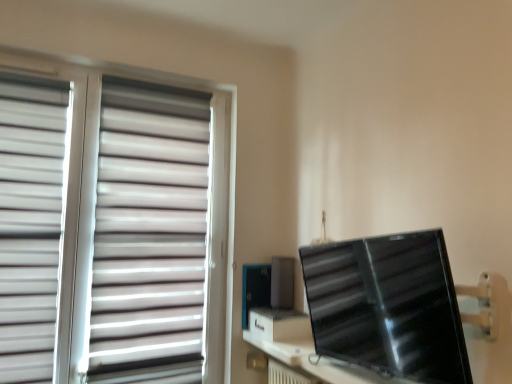
What is the approximate width of white matte blinds at left, the second curtain viewed from the right?

It is 3.54 inches.

Where is `white matte blinds at left, which is the 2th curtain in left-to-right order`? white matte blinds at left, which is the 2th curtain in left-to-right order is located at coordinates (150, 234).

Between white matte blinds at left, marked as the 1th curtain in a right-to-left arrangement, and white matte blinds at left, the first curtain viewed from the left, which one has more height?

white matte blinds at left, marked as the 1th curtain in a right-to-left arrangement.

Is white matte blinds at left, which is the 2th curtain in left-to-right order, next to white matte blinds at left, the second curtain viewed from the right?

No, white matte blinds at left, which is the 2th curtain in left-to-right order, is not beside white matte blinds at left, the second curtain viewed from the right.

Locate an element on the screen. computer monitor lying on the right of white matte blinds at left, which is the 2th curtain in left-to-right order is located at coordinates (388, 306).

From the image's perspective, which one is positioned higher, white matte blinds at left, which is the 2th curtain in left-to-right order, or black glossy monitor at right?

white matte blinds at left, which is the 2th curtain in left-to-right order, from the image's perspective.

From a real-world perspective, which is physically above, white matte blinds at left, which is the 2th curtain in left-to-right order, or black glossy monitor at right?

Answer: white matte blinds at left, which is the 2th curtain in left-to-right order, is physically above.

Is the position of black glossy monitor at right more distant than that of white matte blinds at left, the second curtain viewed from the right?

No, it is in front of white matte blinds at left, the second curtain viewed from the right.

Is black glossy monitor at right oriented towards white matte blinds at left, the second curtain viewed from the right?

No.

Would you say white matte blinds at left, the second curtain viewed from the right, is part of black glossy monitor at right's contents?

No, black glossy monitor at right does not contain white matte blinds at left, the second curtain viewed from the right.

From a real-world perspective, who is located higher, white matte blinds at left, marked as the 1th curtain in a right-to-left arrangement, or white matte blinds at left?

white matte blinds at left, marked as the 1th curtain in a right-to-left arrangement.

Is white matte blinds at left, marked as the 1th curtain in a right-to-left arrangement, positioned with its back to white matte blinds at left?

Yes, white matte blinds at left, marked as the 1th curtain in a right-to-left arrangement, is positioned with its back facing white matte blinds at left.

Is white matte blinds at left, marked as the 1th curtain in a right-to-left arrangement, wider or thinner than white matte blinds at left?

Considering their sizes, white matte blinds at left, marked as the 1th curtain in a right-to-left arrangement, looks broader than white matte blinds at left.

Considering the relative positions of white matte blinds at left, which is the 2th curtain in left-to-right order, and white matte blinds at left in the image provided, is white matte blinds at left, which is the 2th curtain in left-to-right order, to the left of white matte blinds at left from the viewer's perspective?

Incorrect, white matte blinds at left, which is the 2th curtain in left-to-right order, is not on the left side of white matte blinds at left.

Does white matte blinds at left appear on the left side of white matte blinds at left, which is the 2th curtain in left-to-right order?

Yes.

Looking at this image, considering the sizes of objects white matte blinds at left and white matte blinds at left, marked as the 1th curtain in a right-to-left arrangement, in the image provided, who is thinner, white matte blinds at left or white matte blinds at left, marked as the 1th curtain in a right-to-left arrangement,?

white matte blinds at left.

Does point (116, 202) come behind point (164, 307)?

No.

Who is shorter, white matte blinds at left, the first curtain viewed from the left, or white matte blinds at left, marked as the 1th curtain in a right-to-left arrangement?

white matte blinds at left, the first curtain viewed from the left, is shorter.

Is white matte blinds at left, the first curtain viewed from the left, to the right of white matte blinds at left, marked as the 1th curtain in a right-to-left arrangement, from the viewer's perspective?

Incorrect, white matte blinds at left, the first curtain viewed from the left, is not on the right side of white matte blinds at left, marked as the 1th curtain in a right-to-left arrangement.

Can you confirm if white matte blinds at left, the second curtain viewed from the right, is smaller than white matte blinds at left, marked as the 1th curtain in a right-to-left arrangement?

Indeed, white matte blinds at left, the second curtain viewed from the right, has a smaller size compared to white matte blinds at left, marked as the 1th curtain in a right-to-left arrangement.

Can you confirm if white matte blinds at left, the first curtain viewed from the left, is thinner than white matte blinds at left, which is the 2th curtain in left-to-right order?

Correct, the width of white matte blinds at left, the first curtain viewed from the left, is less than that of white matte blinds at left, which is the 2th curtain in left-to-right order.

Which of these two, white matte blinds at left or black glossy monitor at right, is thinner?

Thinner between the two is white matte blinds at left.

Based on their sizes in the image, would you say white matte blinds at left is bigger or smaller than black glossy monitor at right?

Clearly, white matte blinds at left is larger in size than black glossy monitor at right.

From a real-world perspective, between white matte blinds at left and black glossy monitor at right, who is vertically higher?

white matte blinds at left.

Which object is further away from the camera, white matte blinds at left or black glossy monitor at right?

white matte blinds at left.

The width and height of the screenshot is (512, 384). In the image, there is a white matte blinds at left, the first curtain viewed from the left. Identify the location of curtain below it (from the image's perspective). click(x=150, y=234).

At what (x,y) coordinates should I click in order to perform the action: click on computer monitor on the right side of white matte blinds at left, marked as the 1th curtain in a right-to-left arrangement. Please return your answer as a coordinate pair (x, y). Looking at the image, I should click on (388, 306).

Based on their spatial positions, is white matte blinds at left or white matte blinds at left, the second curtain viewed from the right, further from black glossy monitor at right?

white matte blinds at left, the second curtain viewed from the right.

When comparing their distances from white matte blinds at left, does white matte blinds at left, which is the 2th curtain in left-to-right order, or white matte blinds at left, the first curtain viewed from the left, seem closer?

Among the two, white matte blinds at left, which is the 2th curtain in left-to-right order, is located nearer to white matte blinds at left.

Considering their positions, is white matte blinds at left, the first curtain viewed from the left, positioned closer to black glossy monitor at right than white matte blinds at left, which is the 2th curtain in left-to-right order?

Based on the image, white matte blinds at left, which is the 2th curtain in left-to-right order, appears to be nearer to black glossy monitor at right.

Based on the photo, which object lies nearer to the anchor point white matte blinds at left, the first curtain viewed from the left, white matte blinds at left or black glossy monitor at right?

Among the two, white matte blinds at left is located nearer to white matte blinds at left, the first curtain viewed from the left.

When comparing their distances from white matte blinds at left, the second curtain viewed from the right, does white matte blinds at left, marked as the 1th curtain in a right-to-left arrangement, or black glossy monitor at right seem further?

black glossy monitor at right is positioned further to the anchor white matte blinds at left, the second curtain viewed from the right.

From the image, which object appears to be farther from white matte blinds at left, white matte blinds at left, the first curtain viewed from the left, or black glossy monitor at right?

black glossy monitor at right.

Estimate the real-world distances between objects in this image. Which object is closer to white matte blinds at left, the first curtain viewed from the left, black glossy monitor at right or white matte blinds at left?

white matte blinds at left.

From the image, which object appears to be nearer to white matte blinds at left, the second curtain viewed from the right, black glossy monitor at right or white matte blinds at left, marked as the 1th curtain in a right-to-left arrangement?

Based on the image, white matte blinds at left, marked as the 1th curtain in a right-to-left arrangement, appears to be nearer to white matte blinds at left, the second curtain viewed from the right.

Where is `window blind between white matte blinds at left, the first curtain viewed from the left, and black glossy monitor at right, in the horizontal direction`? This screenshot has width=512, height=384. window blind between white matte blinds at left, the first curtain viewed from the left, and black glossy monitor at right, in the horizontal direction is located at coordinates (112, 226).

Where is `curtain between white matte blinds at left and black glossy monitor at right`? curtain between white matte blinds at left and black glossy monitor at right is located at coordinates (150, 234).

Find the location of a particular element. This screenshot has width=512, height=384. window blind between white matte blinds at left, the first curtain viewed from the left, and white matte blinds at left, marked as the 1th curtain in a right-to-left arrangement, from left to right is located at coordinates (112, 226).

Where is `curtain located between white matte blinds at left, the second curtain viewed from the right, and black glossy monitor at right in the left-right direction`? The image size is (512, 384). curtain located between white matte blinds at left, the second curtain viewed from the right, and black glossy monitor at right in the left-right direction is located at coordinates (150, 234).